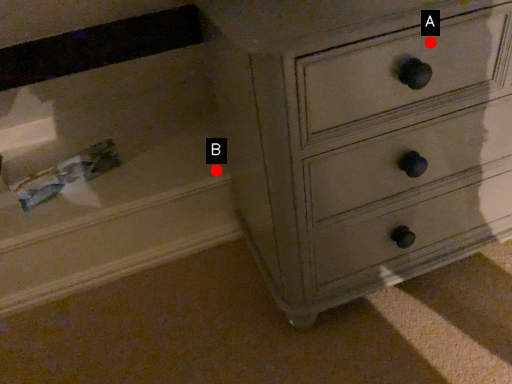
Question: Two points are circled on the image, labeled by A and B beside each circle. Which point is further to the camera?

Choices:
 (A) A is further
 (B) B is further

Answer: (B)